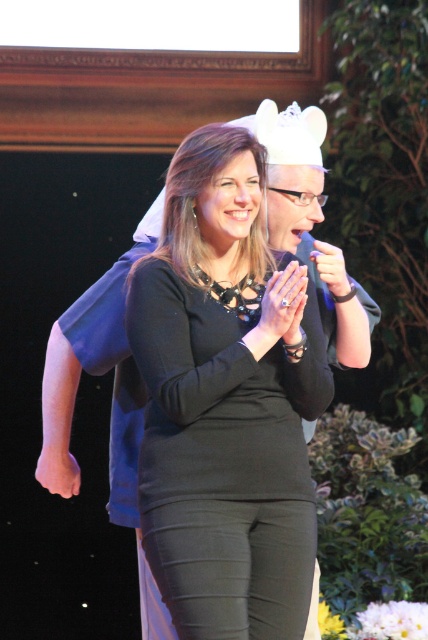
Looking at this image, which of these two, black matte dress at center or smooth skin hand at center, stands shorter?

smooth skin hand at center

Is black matte dress at center thinner than smooth skin hand at center?

In fact, black matte dress at center might be wider than smooth skin hand at center.

You are a GUI agent. You are given a task and a screenshot of the screen. Output one action in this format:
    pyautogui.click(x=<x>, y=<y>)
    Task: Click on the black matte dress at center
    The image size is (428, 640).
    Given the screenshot: What is the action you would take?
    pyautogui.click(x=222, y=404)

The image size is (428, 640). Find the location of `black matte dress at center`. black matte dress at center is located at coordinates (222, 404).

Measure the distance from black matte dress at center to matte black hand at center.

43.01 centimeters

Is black matte dress at center further to camera compared to matte black hand at center?

No, black matte dress at center is in front of matte black hand at center.

I want to click on black matte dress at center, so click(x=222, y=404).

Can you confirm if smooth skin hand at center is bigger than matte black hand at center?

Yes, smooth skin hand at center is bigger than matte black hand at center.

What do you see at coordinates (58, 467) in the screenshot?
I see `smooth skin hand at center` at bounding box center [58, 467].

Find the location of a particular element. smooth skin hand at center is located at coordinates (58, 467).